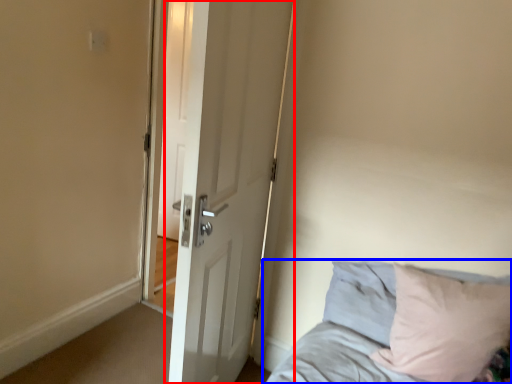
Question: Which object is closer to the camera taking this photo, door (highlighted by a red box) or bed (highlighted by a blue box)?

Choices:
 (A) door
 (B) bed

Answer: (A)